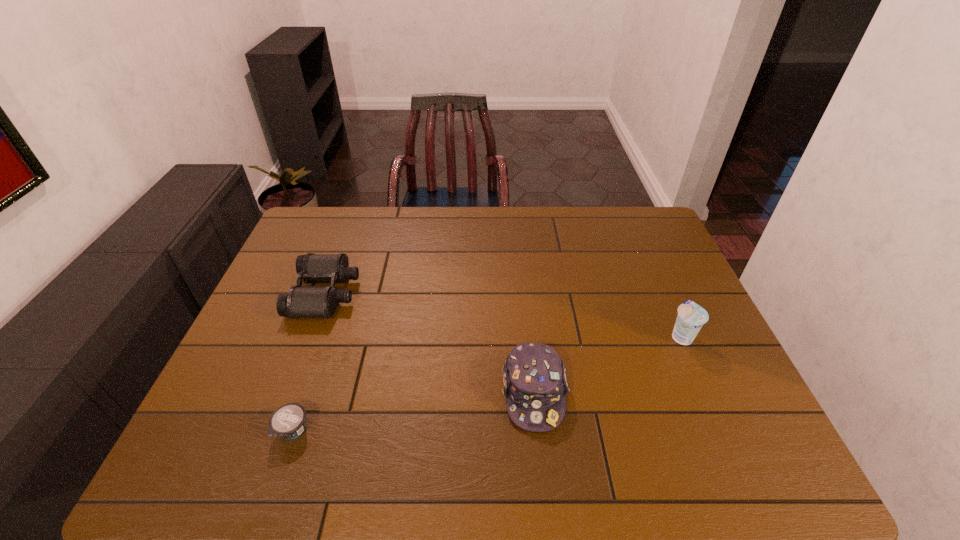
Where is `vacant space at the near right corner of the desktop`? This screenshot has height=540, width=960. vacant space at the near right corner of the desktop is located at coordinates (739, 470).

Locate an element on the screen. The image size is (960, 540). vacant space in between the binoculars and the headwear is located at coordinates (429, 343).

This screenshot has width=960, height=540. I want to click on free spot between the headwear and the taller yogurt, so click(x=608, y=364).

The width and height of the screenshot is (960, 540). Identify the location of vacant area that lies between the second object from right to left and the right yogurt. (608, 364).

Where is `empty location between the left yogurt and the rightmost object`? The height and width of the screenshot is (540, 960). empty location between the left yogurt and the rightmost object is located at coordinates (487, 383).

This screenshot has width=960, height=540. Identify the location of vacant area that lies between the headwear and the shorter yogurt. (413, 411).

You are a GUI agent. You are given a task and a screenshot of the screen. Output one action in this format:
    pyautogui.click(x=<x>, y=<y>)
    Task: Click on the free spot between the shortest object and the right yogurt
    The image size is (960, 540).
    Given the screenshot: What is the action you would take?
    pyautogui.click(x=487, y=383)

The image size is (960, 540). I want to click on empty location between the rightmost object and the nearer yogurt, so click(487, 383).

Find the location of a particular element. Image resolution: width=960 pixels, height=540 pixels. free space between the left yogurt and the binoculars is located at coordinates (309, 362).

Locate an element on the screen. This screenshot has width=960, height=540. empty location between the binoculars and the headwear is located at coordinates (429, 343).